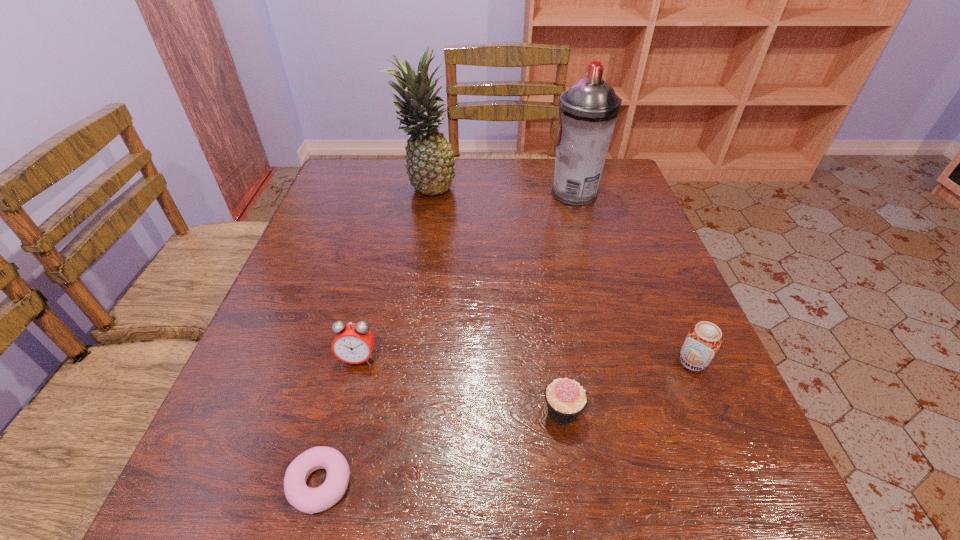
Find the location of a particular element. The width and height of the screenshot is (960, 540). object located at the near left corner is located at coordinates (309, 500).

I want to click on object that is positioned at the far right corner, so click(x=588, y=111).

Locate an element on the screen. vacant space at the far edge is located at coordinates (394, 202).

This screenshot has height=540, width=960. I want to click on vacant space at the near edge of the desktop, so click(436, 489).

You are a GUI agent. You are given a task and a screenshot of the screen. Output one action in this format:
    pyautogui.click(x=<x>, y=<y>)
    Task: Click on the free space at the left edge of the desktop
    The width and height of the screenshot is (960, 540).
    Given the screenshot: What is the action you would take?
    pyautogui.click(x=292, y=454)

Where is `vacant space at the right edge`? The height and width of the screenshot is (540, 960). vacant space at the right edge is located at coordinates (664, 264).

I want to click on vacant region at the far left corner of the desktop, so (x=340, y=172).

At what (x,y) coordinates should I click in order to perform the action: click on free spot at the near right corner of the desktop. Please return your answer as a coordinate pair (x, y). Looking at the image, I should click on (732, 475).

Image resolution: width=960 pixels, height=540 pixels. Identify the location of blank region between the beer can and the alarm clock. (525, 360).

Find the location of a particular element. free space that is in between the pineapple and the third object from right to left is located at coordinates (494, 299).